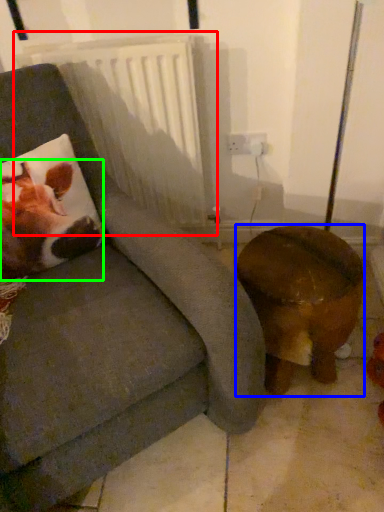
Question: Which object is positioned closest to radiator (highlighted by a red box)? Select from furniture (highlighted by a blue box) and animal (highlighted by a green box).

Choices:
 (A) furniture
 (B) animal

Answer: (B)